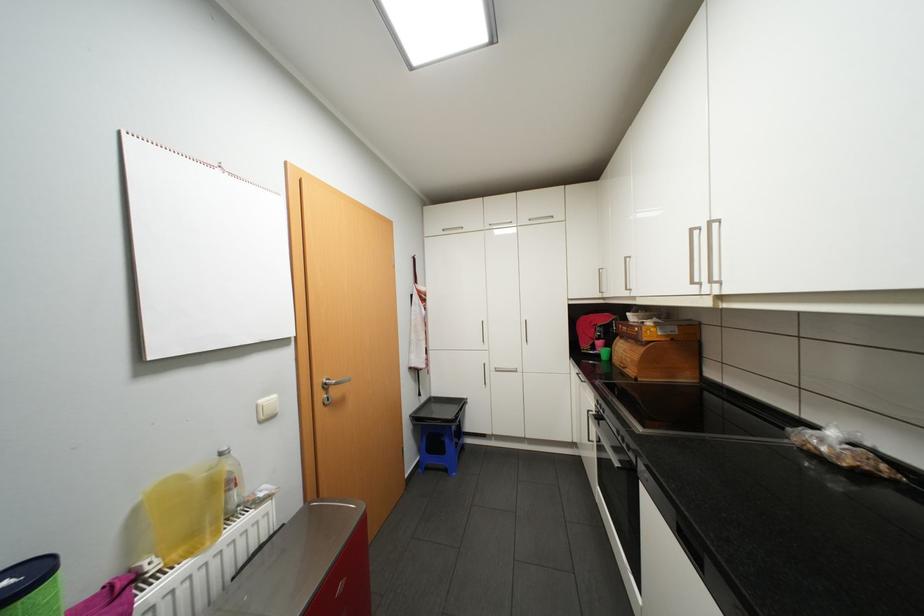
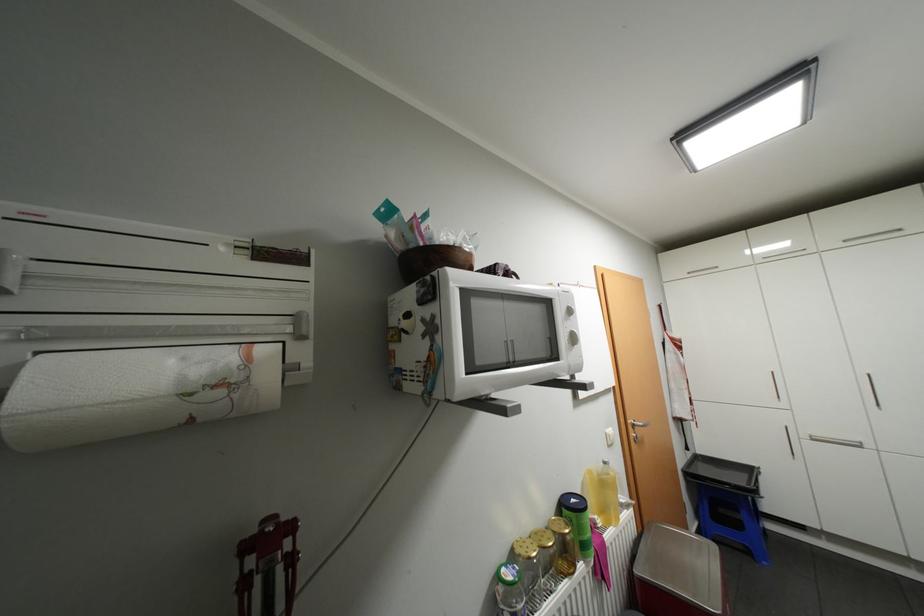
The point at (505,370) is marked in the first image. Where is the corresponding point in the second image?

(821, 438)